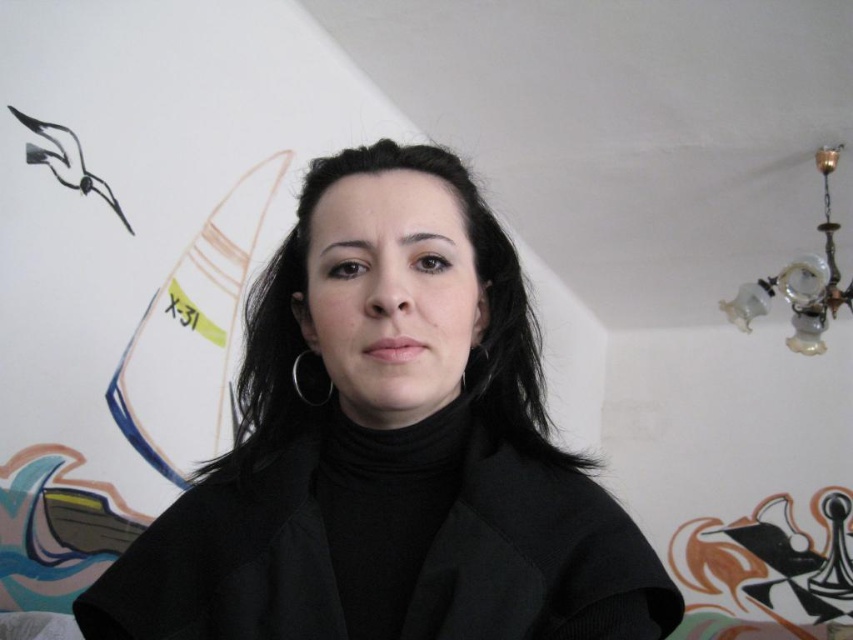
Question: Is black matte jacket at center above black woolen coat at center?

Choices:
 (A) no
 (B) yes

Answer: (B)

Question: Does black matte jacket at center have a greater width compared to black woolen coat at center?

Choices:
 (A) no
 (B) yes

Answer: (B)

Question: Which object is farther from the camera taking this photo?

Choices:
 (A) black woolen coat at center
 (B) black matte jacket at center

Answer: (A)

Question: Which point appears farthest from the camera in this image?

Choices:
 (A) (547, 502)
 (B) (216, 500)

Answer: (B)

Question: Which of the following is the farthest from the observer?

Choices:
 (A) (624, 636)
 (B) (538, 548)

Answer: (B)

Question: Can you confirm if black matte jacket at center is positioned above black woolen coat at center?

Choices:
 (A) no
 (B) yes

Answer: (B)